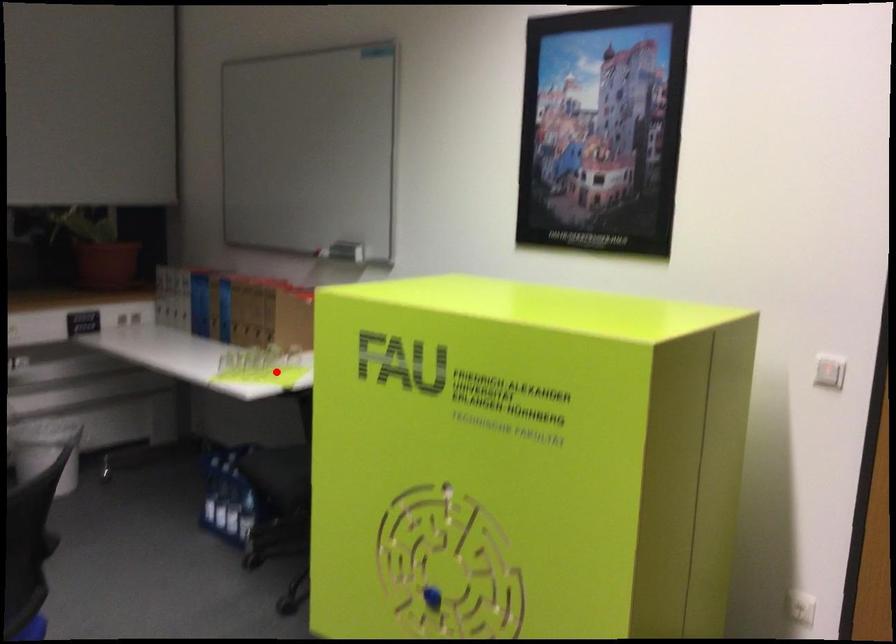
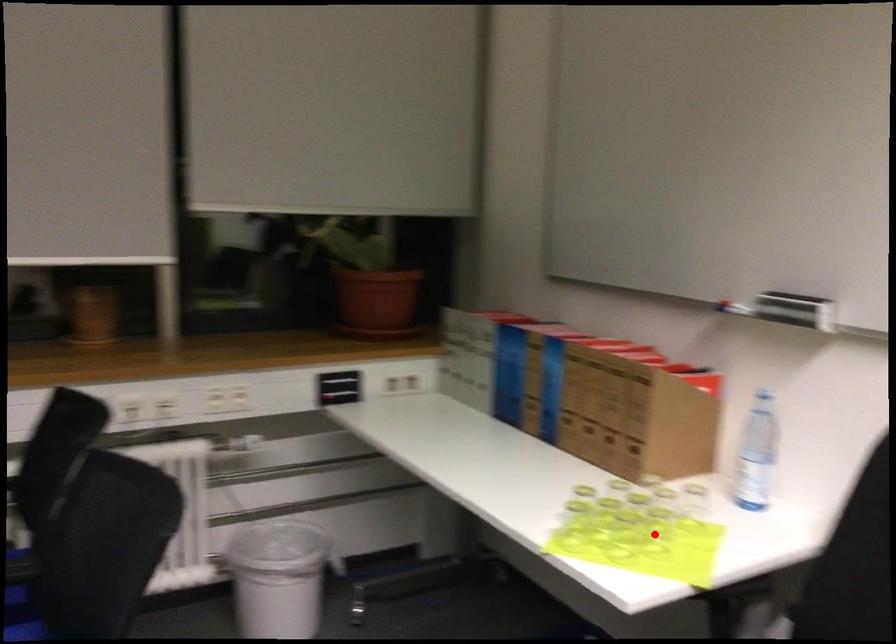
Consider the image. I am providing you with two images of the same scene from different viewpoints. A red point is marked on the first image and another point is marked on the second image. Are the points marked in image1 and image2 representing the same 3D position?

Yes